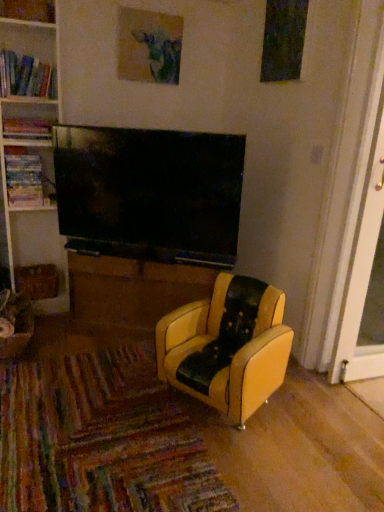
Question: Does multicolored cardboard book at left, the third book when ordered from top to bottom, have a greater height compared to yellow leather chair at center?

Choices:
 (A) yes
 (B) no

Answer: (B)

Question: From a real-world perspective, is multicolored cardboard book at left, which is the first book in bottom-to-top order, positioned over yellow leather chair at center based on gravity?

Choices:
 (A) yes
 (B) no

Answer: (A)

Question: Is yellow leather chair at center a part of multicolored cardboard book at left, the third book when ordered from top to bottom?

Choices:
 (A) no
 (B) yes

Answer: (A)

Question: Is multicolored cardboard book at left, the third book when ordered from top to bottom, bigger than yellow leather chair at center?

Choices:
 (A) no
 (B) yes

Answer: (A)

Question: From the image's perspective, is multicolored cardboard book at left, which is the first book in bottom-to-top order, on yellow leather chair at center?

Choices:
 (A) yes
 (B) no

Answer: (A)

Question: Is multicolored cardboard book at left, the third book when ordered from top to bottom, wider than yellow leather chair at center?

Choices:
 (A) no
 (B) yes

Answer: (A)

Question: Considering the relative positions of hardcover books at left, the 3th book positioned from the bottom, and hardcover book at left, marked as the 2th book in a top-to-bottom arrangement, in the image provided, is hardcover books at left, the 3th book positioned from the bottom, to the left of hardcover book at left, marked as the 2th book in a top-to-bottom arrangement, from the viewer's perspective?

Choices:
 (A) yes
 (B) no

Answer: (B)

Question: Is hardcover books at left, the 3th book positioned from the bottom, shorter than hardcover book at left, marked as the 2th book in a top-to-bottom arrangement?

Choices:
 (A) yes
 (B) no

Answer: (B)

Question: From a real-world perspective, is hardcover books at left, which ranks as the first book in top-to-bottom order, below hardcover book at left, which appears as the 2th book when ordered from the bottom?

Choices:
 (A) yes
 (B) no

Answer: (B)

Question: Considering the relative sizes of hardcover books at left, which ranks as the first book in top-to-bottom order, and hardcover book at left, which appears as the 2th book when ordered from the bottom, in the image provided, is hardcover books at left, which ranks as the first book in top-to-bottom order, wider than hardcover book at left, which appears as the 2th book when ordered from the bottom,?

Choices:
 (A) no
 (B) yes

Answer: (B)

Question: Does hardcover books at left, which ranks as the first book in top-to-bottom order, appear on the right side of hardcover book at left, marked as the 2th book in a top-to-bottom arrangement?

Choices:
 (A) yes
 (B) no

Answer: (A)

Question: Does hardcover books at left, the 3th book positioned from the bottom, have a smaller size compared to hardcover book at left, which appears as the 2th book when ordered from the bottom?

Choices:
 (A) yes
 (B) no

Answer: (B)

Question: Is white plastic screen door at right inside hardcover books at left, which ranks as the first book in top-to-bottom order?

Choices:
 (A) no
 (B) yes

Answer: (A)